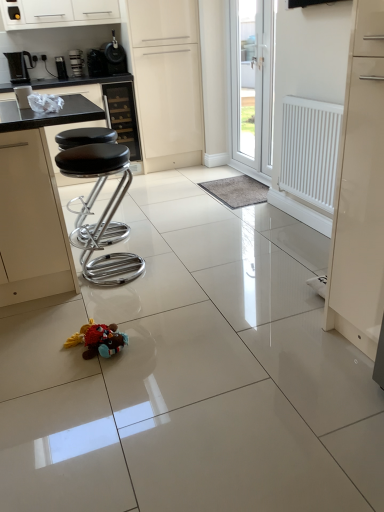
Question: Should I look upward or downward to see black leather bar stools at left?

Choices:
 (A) up
 (B) down

Answer: (A)

Question: Does white glossy cabinet at upper center, acting as the 2th cabinetry starting from the bottom, have a smaller size compared to white matte door at center, acting as the second door starting from the right?

Choices:
 (A) no
 (B) yes

Answer: (B)

Question: Considering the relative positions of white glossy cabinet at upper center, placed as the first cabinetry when sorted from top to bottom, and white matte door at center, the first door viewed from the left, in the image provided, is white glossy cabinet at upper center, placed as the first cabinetry when sorted from top to bottom, behind white matte door at center, the first door viewed from the left,?

Choices:
 (A) yes
 (B) no

Answer: (B)

Question: Considering the relative sizes of white glossy cabinet at upper center, acting as the 2th cabinetry starting from the bottom, and white matte door at center, acting as the second door starting from the right, in the image provided, is white glossy cabinet at upper center, acting as the 2th cabinetry starting from the bottom, bigger than white matte door at center, acting as the second door starting from the right,?

Choices:
 (A) no
 (B) yes

Answer: (A)

Question: Considering the relative sizes of white glossy cabinet at upper center, acting as the 2th cabinetry starting from the bottom, and white matte door at center, acting as the second door starting from the right, in the image provided, is white glossy cabinet at upper center, acting as the 2th cabinetry starting from the bottom, thinner than white matte door at center, acting as the second door starting from the right,?

Choices:
 (A) no
 (B) yes

Answer: (B)

Question: From a real-world perspective, is white glossy cabinet at upper center, placed as the first cabinetry when sorted from top to bottom, physically above white matte door at center, the first door viewed from the left?

Choices:
 (A) yes
 (B) no

Answer: (A)

Question: Is white glossy cabinet at upper center, placed as the first cabinetry when sorted from top to bottom, at the right side of white matte door at center, the first door viewed from the left?

Choices:
 (A) no
 (B) yes

Answer: (A)

Question: Is black leather stool at left shorter than white glossy door at upper center, the 2th door in the left-to-right sequence?

Choices:
 (A) yes
 (B) no

Answer: (A)

Question: Are black leather stool at left and white glossy door at upper center, arranged as the 1th door when viewed from the right, making contact?

Choices:
 (A) yes
 (B) no

Answer: (B)

Question: Can you confirm if black leather stool at left is thinner than white glossy door at upper center, arranged as the 1th door when viewed from the right?

Choices:
 (A) yes
 (B) no

Answer: (B)

Question: Considering the relative sizes of black leather stool at left and white glossy door at upper center, the 2th door in the left-to-right sequence, in the image provided, is black leather stool at left bigger than white glossy door at upper center, the 2th door in the left-to-right sequence,?

Choices:
 (A) no
 (B) yes

Answer: (A)

Question: From the image's perspective, is black leather stool at left beneath white glossy door at upper center, the 2th door in the left-to-right sequence?

Choices:
 (A) no
 (B) yes

Answer: (B)

Question: Considering the relative positions of black leather stool at left and white glossy door at upper center, arranged as the 1th door when viewed from the right, in the image provided, is black leather stool at left in front of white glossy door at upper center, arranged as the 1th door when viewed from the right,?

Choices:
 (A) yes
 (B) no

Answer: (A)

Question: Considering the relative sizes of white glossy door at upper center, the 2th door in the left-to-right sequence, and white matte door at center, the first door viewed from the left, in the image provided, is white glossy door at upper center, the 2th door in the left-to-right sequence, smaller than white matte door at center, the first door viewed from the left,?

Choices:
 (A) yes
 (B) no

Answer: (A)